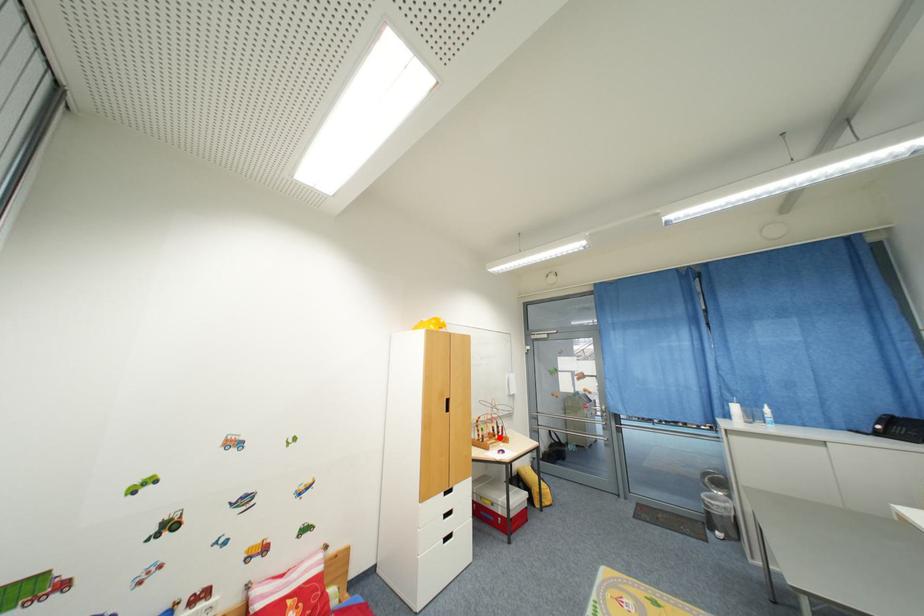
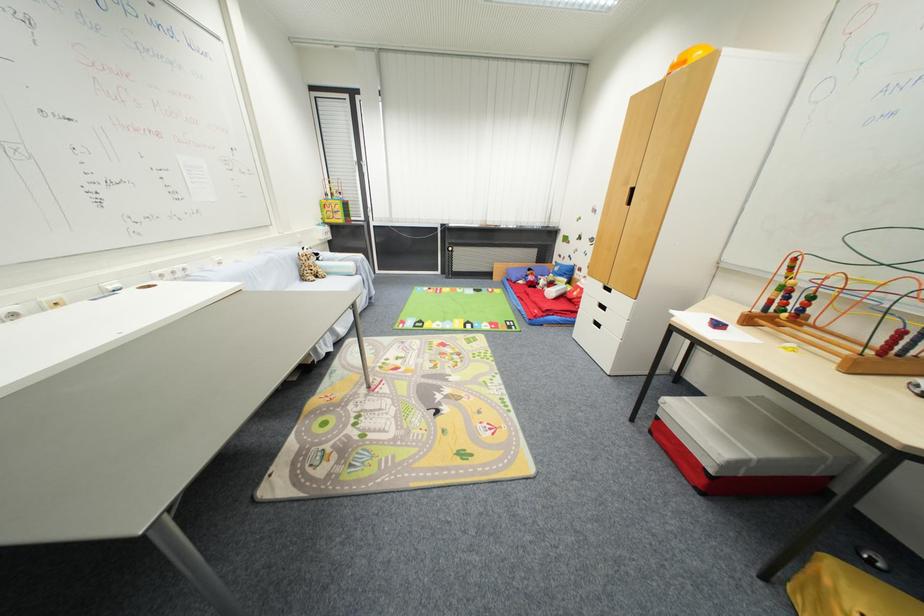
In the second image, find the point that corresponds to the highlighted location in the first image.

(789, 313)